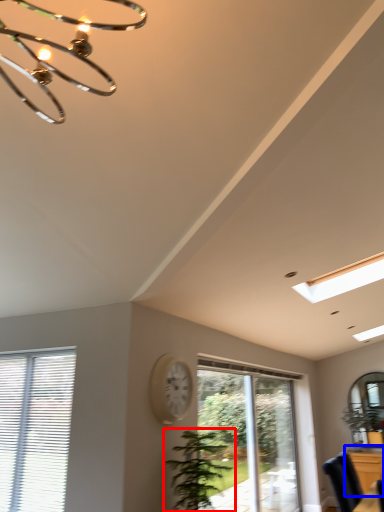
Question: Among these objects, which one is nearest to the camera, houseplant (highlighted by a red box) or dresser (highlighted by a blue box)?

Choices:
 (A) houseplant
 (B) dresser

Answer: (A)